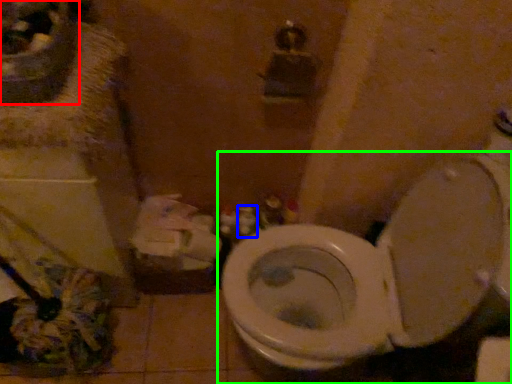
Question: Which object is positioned farthest from sink (highlighted by a red box)? Select from toiletry (highlighted by a blue box) and toilet (highlighted by a green box).

Choices:
 (A) toiletry
 (B) toilet

Answer: (A)